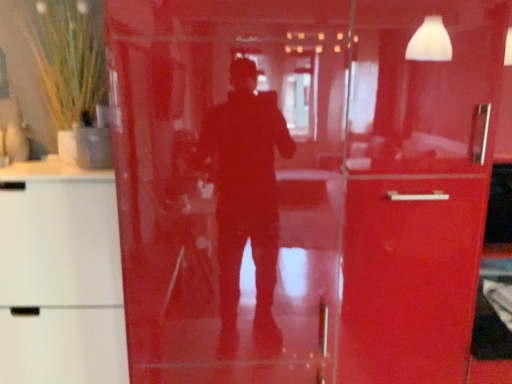
This screenshot has height=384, width=512. What do you see at coordinates (70, 59) in the screenshot?
I see `green grass-like plant in vase at upper left` at bounding box center [70, 59].

The image size is (512, 384). I want to click on green grass-like plant in vase at upper left, so click(70, 59).

Measure the distance between point (67,33) and camera.

1.51 meters.

What is the approximate width of green grass-like plant in vase at upper left?

green grass-like plant in vase at upper left is 8.21 inches in width.

What is the approximate height of white matte cabinet at left?

white matte cabinet at left is 3.52 feet in height.

The image size is (512, 384). What do you see at coordinates (61, 285) in the screenshot? I see `white matte cabinet at left` at bounding box center [61, 285].

You are a GUI agent. You are given a task and a screenshot of the screen. Output one action in this format:
    pyautogui.click(x=<x>, y=<y>)
    Task: Click on the white matte cabinet at left
    
    Given the screenshot: What is the action you would take?
    pyautogui.click(x=61, y=285)

This screenshot has width=512, height=384. Identify the location of green grass-like plant in vase at upper left. (70, 59).

Visually, is white matte cabinet at left positioned to the left or to the right of green grass-like plant in vase at upper left?

Based on their positions, white matte cabinet at left is located to the left of green grass-like plant in vase at upper left.

Which object is further away from the camera, white matte cabinet at left or green grass-like plant in vase at upper left?

green grass-like plant in vase at upper left.

Considering the points (30, 261) and (69, 120), which point is behind, point (30, 261) or point (69, 120)?

The point (69, 120) is behind.

From the image's perspective, which one is positioned higher, white matte cabinet at left or green grass-like plant in vase at upper left?

green grass-like plant in vase at upper left, from the image's perspective.

From a real-world perspective, is white matte cabinet at left physically below green grass-like plant in vase at upper left?

Indeed, from a real-world perspective, white matte cabinet at left is positioned beneath green grass-like plant in vase at upper left.

Between white matte cabinet at left and green grass-like plant in vase at upper left, which one has smaller width?

With smaller width is green grass-like plant in vase at upper left.

Considering the sizes of white matte cabinet at left and green grass-like plant in vase at upper left in the image, is white matte cabinet at left taller or shorter than green grass-like plant in vase at upper left?

white matte cabinet at left is taller than green grass-like plant in vase at upper left.

Considering the relative sizes of white matte cabinet at left and green grass-like plant in vase at upper left in the image provided, is white matte cabinet at left bigger than green grass-like plant in vase at upper left?

Correct, white matte cabinet at left is larger in size than green grass-like plant in vase at upper left.

Would you say white matte cabinet at left is inside or outside green grass-like plant in vase at upper left?

white matte cabinet at left is not enclosed by green grass-like plant in vase at upper left.

Is the surface of white matte cabinet at left in direct contact with green grass-like plant in vase at upper left?

No, white matte cabinet at left is not beside green grass-like plant in vase at upper left.

Is white matte cabinet at left positioned with its back to green grass-like plant in vase at upper left?

No, white matte cabinet at left's orientation is not away from green grass-like plant in vase at upper left.

What's the angular difference between white matte cabinet at left and green grass-like plant in vase at upper left's facing directions?

0.749 degrees.

The image size is (512, 384). I want to click on plant that appears behind the white matte cabinet at left, so click(x=70, y=59).

Considering the relative positions of green grass-like plant in vase at upper left and white matte cabinet at left in the image provided, is green grass-like plant in vase at upper left to the left of white matte cabinet at left from the viewer's perspective?

Incorrect, green grass-like plant in vase at upper left is not on the left side of white matte cabinet at left.

Does green grass-like plant in vase at upper left lie in front of white matte cabinet at left?

No, the depth of green grass-like plant in vase at upper left is greater than that of white matte cabinet at left.

Is point (69, 13) closer or farther from the camera than point (97, 287)?

Point (69, 13) is positioned farther from the camera compared to point (97, 287).

From the image's perspective, who appears lower, green grass-like plant in vase at upper left or white matte cabinet at left?

From the image's view, white matte cabinet at left is below.

In the scene shown: From a real-world perspective, relative to white matte cabinet at left, is green grass-like plant in vase at upper left vertically above or below?

green grass-like plant in vase at upper left is situated higher than white matte cabinet at left in the real world.

Which object is thinner, green grass-like plant in vase at upper left or white matte cabinet at left?

Thinner between the two is green grass-like plant in vase at upper left.

Can you confirm if green grass-like plant in vase at upper left is taller than white matte cabinet at left?

Incorrect, the height of green grass-like plant in vase at upper left is not larger of that of white matte cabinet at left.

Is green grass-like plant in vase at upper left bigger than white matte cabinet at left?

No, green grass-like plant in vase at upper left is not bigger than white matte cabinet at left.

Is green grass-like plant in vase at upper left completely or partially outside of white matte cabinet at left?

green grass-like plant in vase at upper left is positioned outside white matte cabinet at left.

Is green grass-like plant in vase at upper left not close to white matte cabinet at left?

No, green grass-like plant in vase at upper left is not far away from white matte cabinet at left.

Does green grass-like plant in vase at upper left turn towards white matte cabinet at left?

No, green grass-like plant in vase at upper left does not turn towards white matte cabinet at left.

How far apart are green grass-like plant in vase at upper left and white matte cabinet at left?

A distance of 21.07 inches exists between green grass-like plant in vase at upper left and white matte cabinet at left.

Identify the location of cabinetry below the green grass-like plant in vase at upper left (from the image's perspective). tap(61, 285).

At what (x,y) coordinates should I click in order to perform the action: click on cabinetry lying on the left of green grass-like plant in vase at upper left. Please return your answer as a coordinate pair (x, y). This screenshot has height=384, width=512. Looking at the image, I should click on (61, 285).

Locate an element on the screen. Image resolution: width=512 pixels, height=384 pixels. cabinetry in front of the green grass-like plant in vase at upper left is located at coordinates (61, 285).